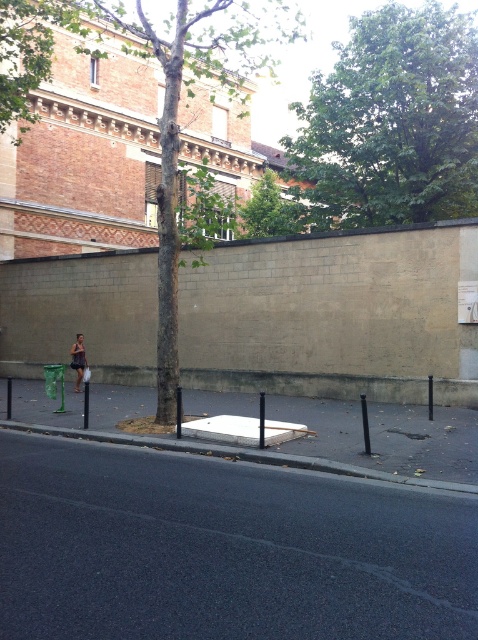
You are a city planner assessing the urban space. You notice the green leafy tree at upper center and the green textured tree at center. Which tree is taller?

The green textured tree at center is taller than the green leafy tree at upper center.

You are standing on the sidewalk in the urban street scene. You see the green leafy tree at upper center. Can you determine if the tree is closer to the foreground or the middle ground of the image?

The green leafy tree at upper center is located at point 0.192 on the vertical axis, which places it closer to the foreground since lower values on the vertical axis indicate proximity to the viewer. Therefore, the tree is in the foreground.